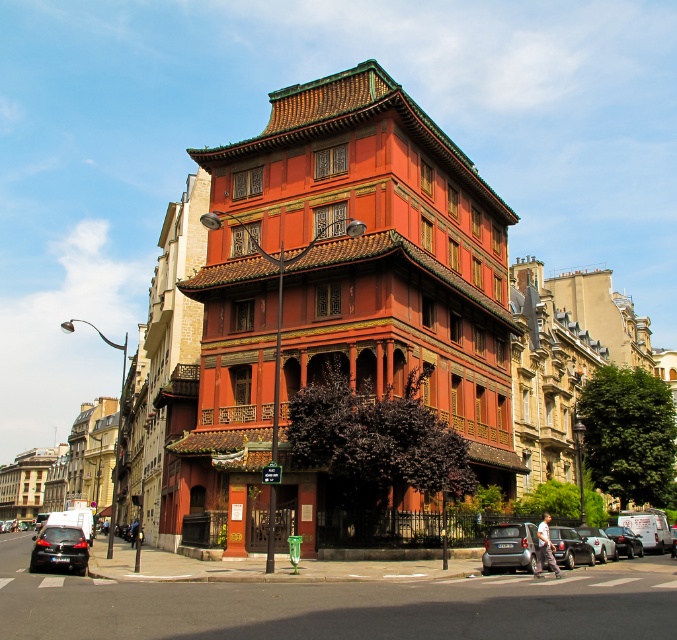
Question: Which point appears closest to the camera in this image?

Choices:
 (A) (525, 524)
 (B) (567, 548)
 (C) (66, 563)
 (D) (603, 556)

Answer: (C)

Question: Which of these objects is positioned closest to the matte silver car at lower right?

Choices:
 (A) matte red wood tower at center
 (B) shiny black sedan at center
 (C) metallic silver van at lower right

Answer: (B)

Question: Does shiny black sedan at lower left come in front of metallic silver car at center?

Choices:
 (A) yes
 (B) no

Answer: (A)

Question: Can you confirm if shiny black sedan at lower left is positioned below metallic silver car at center?

Choices:
 (A) no
 (B) yes

Answer: (B)

Question: Is matte silver car at lower right behind shiny black sedan at center?

Choices:
 (A) no
 (B) yes

Answer: (A)

Question: Which point appears farthest from the camera in this image?

Choices:
 (A) click(x=43, y=541)
 (B) click(x=504, y=538)

Answer: (A)